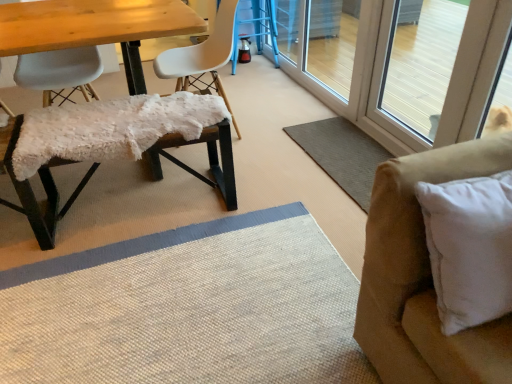
Question: Is white soft pillow at right located within transparent glass screen door at right, which is the 2th screen door in back-to-front order?

Choices:
 (A) yes
 (B) no

Answer: (B)

Question: Can you confirm if transparent glass screen door at right, which is the 2th screen door in back-to-front order, is wider than white soft pillow at right?

Choices:
 (A) no
 (B) yes

Answer: (A)

Question: Is transparent glass screen door at right, which is the 2th screen door in back-to-front order, facing away from white soft pillow at right?

Choices:
 (A) no
 (B) yes

Answer: (A)

Question: Does transparent glass screen door at right, positioned as the first screen door in front-to-back order, have a lesser width compared to white soft pillow at right?

Choices:
 (A) yes
 (B) no

Answer: (A)

Question: From a real-world perspective, is transparent glass screen door at right, positioned as the first screen door in front-to-back order, located higher than white soft pillow at right?

Choices:
 (A) yes
 (B) no

Answer: (B)

Question: Considering the relative sizes of transparent glass screen door at right, positioned as the first screen door in front-to-back order, and white soft pillow at right in the image provided, is transparent glass screen door at right, positioned as the first screen door in front-to-back order, taller than white soft pillow at right?

Choices:
 (A) no
 (B) yes

Answer: (B)

Question: Is white fluffy bench at left, arranged as the 2th chair when viewed from the right, at the right side of white matte chair at center, the third chair when ordered from left to right?

Choices:
 (A) yes
 (B) no

Answer: (B)

Question: Is white fluffy bench at left, marked as the second chair in a left-to-right arrangement, bigger than white matte chair at center, the third chair when ordered from left to right?

Choices:
 (A) no
 (B) yes

Answer: (A)

Question: Is white fluffy bench at left, arranged as the 2th chair when viewed from the right, aimed at white matte chair at center, the third chair when ordered from left to right?

Choices:
 (A) no
 (B) yes

Answer: (A)

Question: From a real-world perspective, is white fluffy bench at left, arranged as the 2th chair when viewed from the right, located higher than white matte chair at center, the third chair when ordered from left to right?

Choices:
 (A) yes
 (B) no

Answer: (B)

Question: Is white fluffy bench at left, arranged as the 2th chair when viewed from the right, far away from white matte chair at center, which is the 1th chair in right-to-left order?

Choices:
 (A) no
 (B) yes

Answer: (A)

Question: Is white fluffy bench at left, marked as the second chair in a left-to-right arrangement, positioned beyond the bounds of white matte chair at center, which is the 1th chair in right-to-left order?

Choices:
 (A) no
 (B) yes

Answer: (B)

Question: Can you confirm if white soft pillow at right is smaller than transparent glass screen door at upper right, which appears as the first screen door when viewed from the back?

Choices:
 (A) yes
 (B) no

Answer: (A)